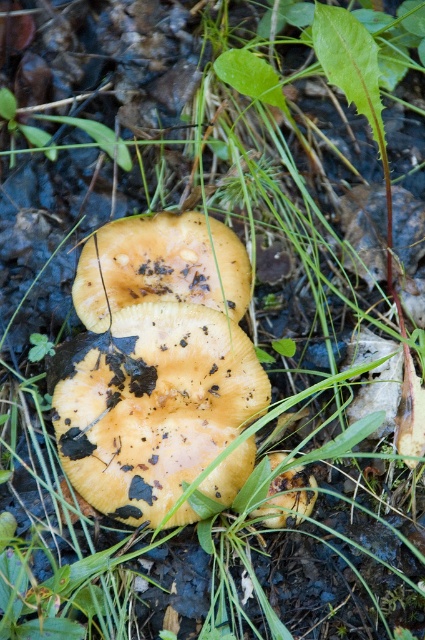
Between light brown textured mushroom at center and yellow matte mushroom at center, which one is positioned higher?

light brown textured mushroom at center is higher up.

Which of these two, light brown textured mushroom at center or yellow matte mushroom at center, stands taller?

With more height is light brown textured mushroom at center.

This screenshot has width=425, height=640. I want to click on light brown textured mushroom at center, so click(x=161, y=266).

I want to click on light brown textured mushroom at center, so pos(161,266).

Does yellowish-brown textured mushroom at center have a greater height compared to yellow matte mushroom at center?

Indeed, yellowish-brown textured mushroom at center has a greater height compared to yellow matte mushroom at center.

Who is more distant from viewer, (99, 483) or (286, 481)?

The point (286, 481) is more distant.

Which is behind, point (76, 412) or point (278, 492)?

Positioned behind is point (76, 412).

Where is `yellowish-brown textured mushroom at center`? yellowish-brown textured mushroom at center is located at coordinates (152, 403).

Who is more distant from viewer, (x=76, y=465) or (x=90, y=280)?

Positioned behind is point (x=90, y=280).

Identify the location of yellowish-brown textured mushroom at center. (152, 403).

Which is behind, point (189, 406) or point (181, 256)?

The point (181, 256) is more distant.

Where is `yellowish-brown textured mushroom at center`? yellowish-brown textured mushroom at center is located at coordinates (152, 403).